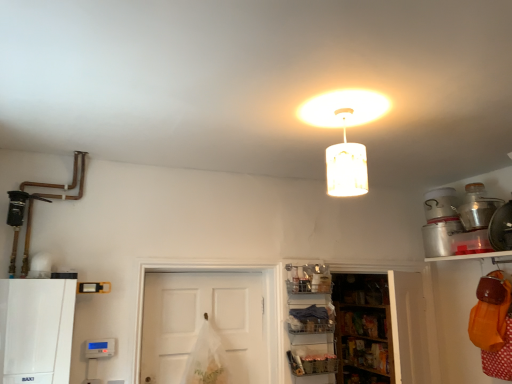
Question: From the image's perspective, is metallic silver shelf at lower right, the second shelf from the left, on orange fabric bag at lower right, which ranks as the 4th shelf in left-to-right order?

Choices:
 (A) no
 (B) yes

Answer: (A)

Question: Can we say metallic silver shelf at lower right, marked as the 3th shelf in a right-to-left arrangement, lies outside orange fabric bag at lower right, which ranks as the 4th shelf in left-to-right order?

Choices:
 (A) no
 (B) yes

Answer: (B)

Question: From a real-world perspective, does metallic silver shelf at lower right, the second shelf from the left, sit lower than orange fabric bag at lower right, the 1th shelf when ordered from right to left?

Choices:
 (A) yes
 (B) no

Answer: (A)

Question: Is metallic silver shelf at lower right, marked as the 3th shelf in a right-to-left arrangement, facing away from orange fabric bag at lower right, which ranks as the 4th shelf in left-to-right order?

Choices:
 (A) yes
 (B) no

Answer: (B)

Question: From a real-world perspective, is metallic silver shelf at lower right, marked as the 3th shelf in a right-to-left arrangement, on top of orange fabric bag at lower right, the 1th shelf when ordered from right to left?

Choices:
 (A) yes
 (B) no

Answer: (B)

Question: Is orange fabric bag at lower right, the 1th shelf when ordered from right to left, bigger or smaller than white matte door at center?

Choices:
 (A) small
 (B) big

Answer: (A)

Question: Considering the positions of orange fabric bag at lower right, which ranks as the 4th shelf in left-to-right order, and white matte door at center in the image, is orange fabric bag at lower right, which ranks as the 4th shelf in left-to-right order, taller or shorter than white matte door at center?

Choices:
 (A) tall
 (B) short

Answer: (B)

Question: Visually, is orange fabric bag at lower right, the 1th shelf when ordered from right to left, positioned to the left or to the right of white matte door at center?

Choices:
 (A) left
 (B) right

Answer: (B)

Question: From a real-world perspective, is orange fabric bag at lower right, the 1th shelf when ordered from right to left, physically located above or below white matte door at center?

Choices:
 (A) above
 (B) below

Answer: (A)

Question: From the image's perspective, is white matte lampshade at upper center located above or below metallic silver shelf at lower right, the second shelf from the left?

Choices:
 (A) above
 (B) below

Answer: (A)

Question: Is point (331, 150) closer or farther from the camera than point (314, 365)?

Choices:
 (A) farther
 (B) closer

Answer: (B)

Question: Is white matte lampshade at upper center taller or shorter than metallic silver shelf at lower right, marked as the 3th shelf in a right-to-left arrangement?

Choices:
 (A) short
 (B) tall

Answer: (B)

Question: Is white matte lampshade at upper center bigger or smaller than metallic silver shelf at lower right, the second shelf from the left?

Choices:
 (A) small
 (B) big

Answer: (B)

Question: In the image, is metallic silver shelf at lower right, the second shelf from the left, positioned in front of or behind wooden shelves at lower center, the third shelf in the left-to-right sequence?

Choices:
 (A) behind
 (B) front

Answer: (B)

Question: From the image's perspective, relative to wooden shelves at lower center, which appears as the 2th shelf when viewed from the right, is metallic silver shelf at lower right, the second shelf from the left, above or below?

Choices:
 (A) below
 (B) above

Answer: (A)